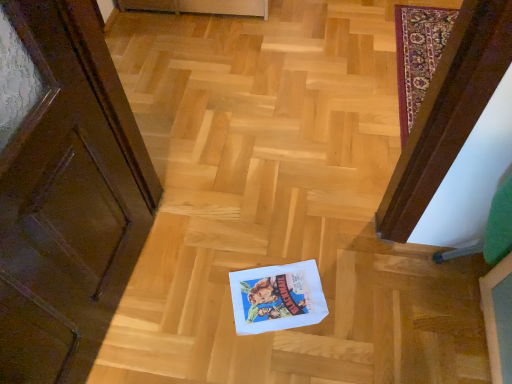
Where is `free space underneath carpeted mat at upper right (from a real-world perspective)`? free space underneath carpeted mat at upper right (from a real-world perspective) is located at coordinates (421, 57).